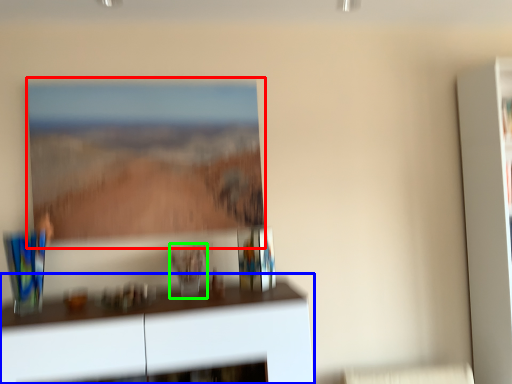
Question: Based on their relative distances, which object is farther from picture frame (highlighted by a red box)? Choose from furniture (highlighted by a blue box) and glass vase (highlighted by a green box).

Choices:
 (A) furniture
 (B) glass vase

Answer: (A)